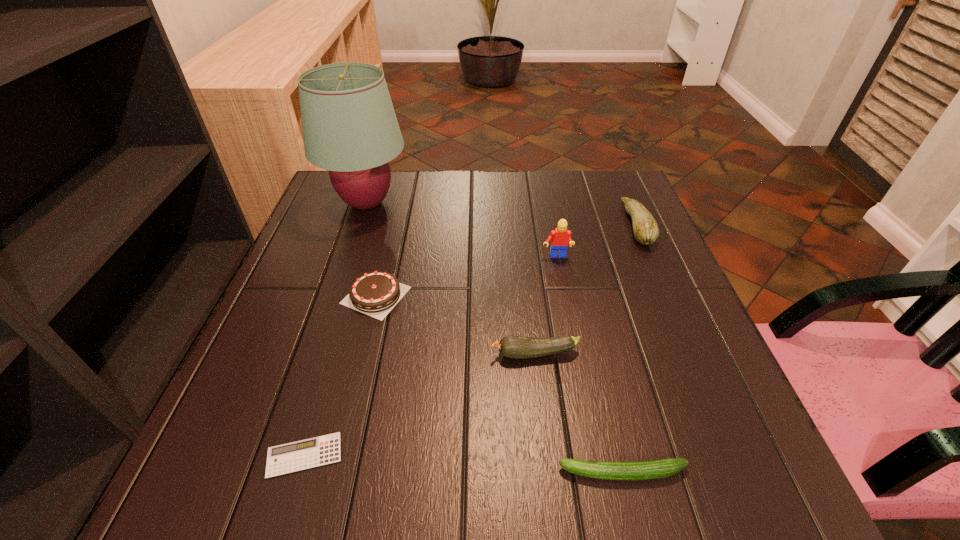
Where is `chocolate cake that is at the left edge`? chocolate cake that is at the left edge is located at coordinates (375, 293).

Where is `calculator located at the left edge`? calculator located at the left edge is located at coordinates (300, 455).

The height and width of the screenshot is (540, 960). I want to click on object that is at the far left corner, so click(350, 128).

Identify the location of object positioned at the near left corner. Image resolution: width=960 pixels, height=540 pixels. tap(300, 455).

Locate an element on the screen. object that is positioned at the far right corner is located at coordinates (646, 231).

Locate an element on the screen. This screenshot has width=960, height=540. object at the near right corner is located at coordinates (642, 470).

This screenshot has height=540, width=960. I want to click on vacant space at the far edge of the desktop, so click(x=534, y=211).

In the image, there is a desktop. Where is `free space at the near edge`? The height and width of the screenshot is (540, 960). free space at the near edge is located at coordinates (332, 505).

In the image, there is a desktop. Find the location of `vacant space at the left edge`. vacant space at the left edge is located at coordinates (343, 297).

This screenshot has width=960, height=540. In order to click on blank space at the far left corner of the desktop in this screenshot , I will do `click(317, 212)`.